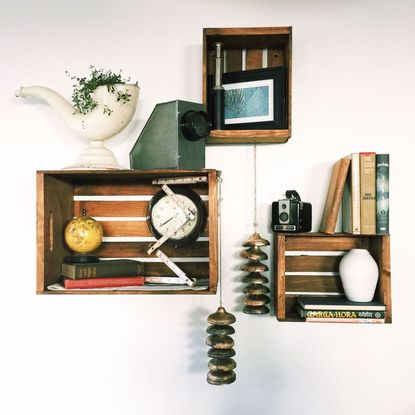
Image resolution: width=415 pixels, height=415 pixels. What are the coordinates of `book` in the screenshot? It's located at (334, 204).